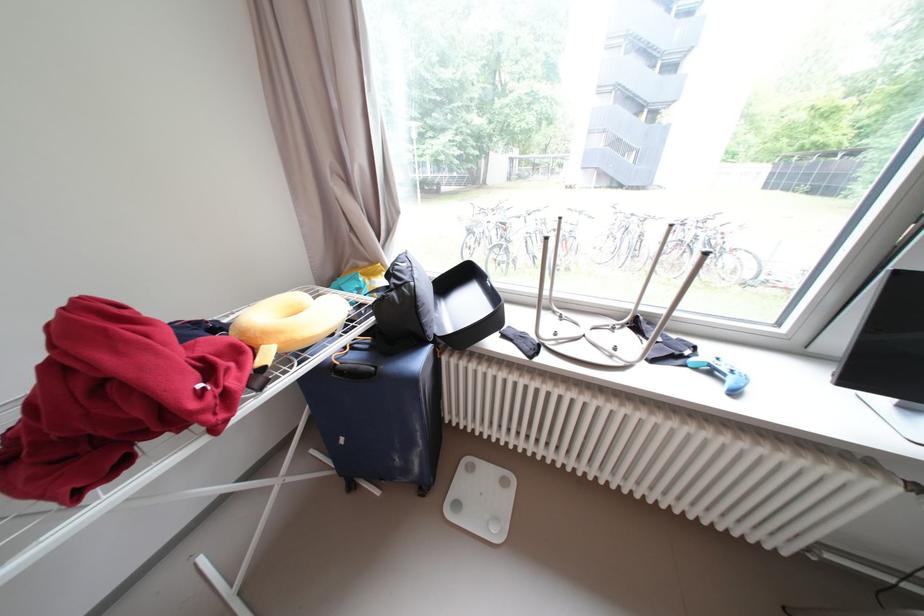
Which object does [444,302] point to?

It refers to a open black case.